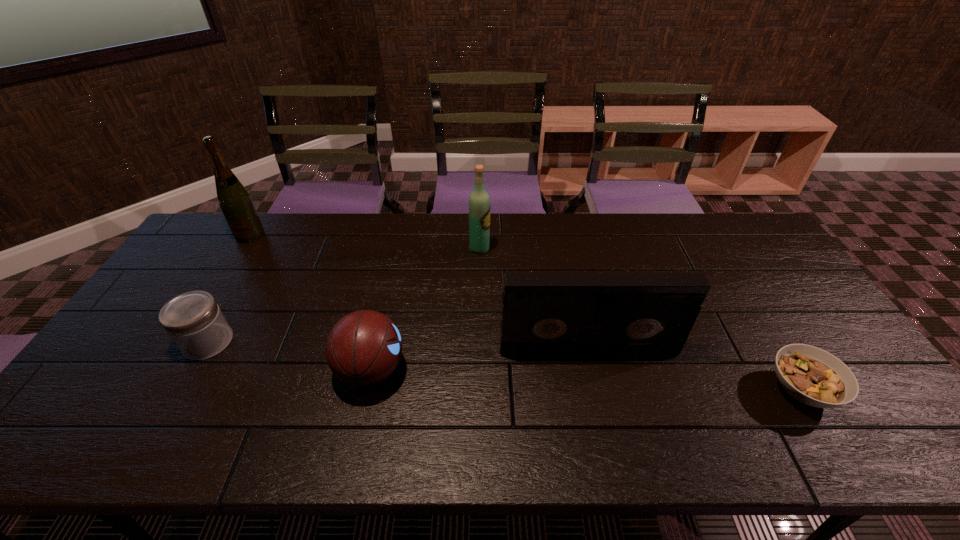
Identify the location of the left wine bottle. The height and width of the screenshot is (540, 960). pos(236,204).

I want to click on the shorter wine bottle, so click(479, 201).

Locate an element on the screen. the right wine bottle is located at coordinates (479, 201).

At what (x,y) coordinates should I click in order to perform the action: click on the second object from right to left. Please return your answer as a coordinate pair (x, y). This screenshot has width=960, height=540. Looking at the image, I should click on (542, 314).

Identify the location of the third tallest object. The width and height of the screenshot is (960, 540). (542, 314).

Locate an element on the screen. The image size is (960, 540). the third object from left to right is located at coordinates (363, 348).

Find the location of a particular element. This screenshot has height=540, width=960. the fourth tallest object is located at coordinates (363, 348).

Identify the location of jar. The image size is (960, 540). (194, 321).

Where is `stew`? The height and width of the screenshot is (540, 960). stew is located at coordinates (813, 376).

Find the location of `the rightmost object`. the rightmost object is located at coordinates (813, 376).